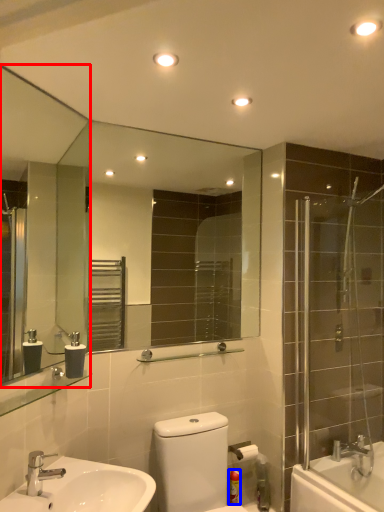
Question: Which object appears closest to the camera in this image, mirror (highlighted by a red box) or toiletry (highlighted by a blue box)?

Choices:
 (A) mirror
 (B) toiletry

Answer: (A)